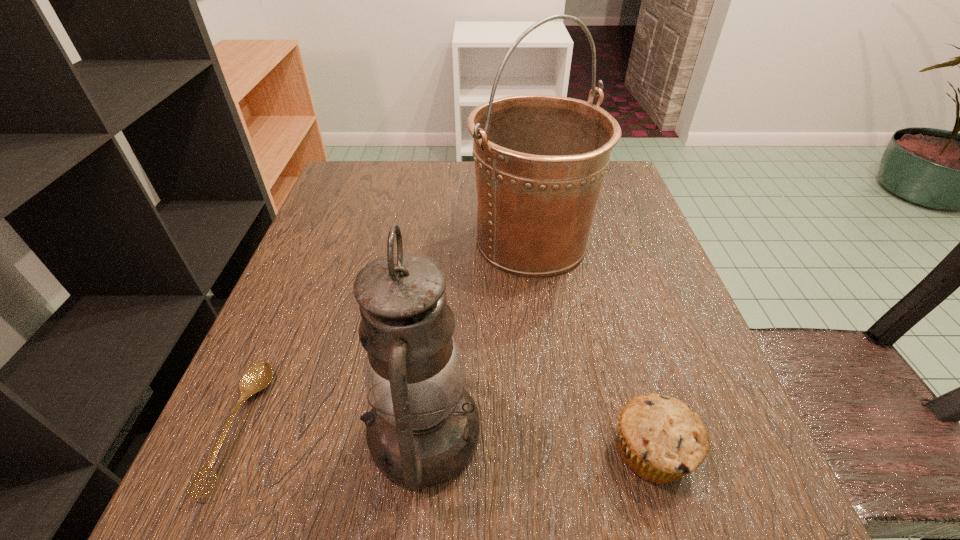
Where is `bucket`? This screenshot has width=960, height=540. bucket is located at coordinates (540, 160).

The height and width of the screenshot is (540, 960). Identify the location of the tallest object. (540, 160).

The image size is (960, 540). Identify the location of oil lamp. (423, 429).

The height and width of the screenshot is (540, 960). What are the coordinates of `the second shortest object` in the screenshot? It's located at (660, 438).

Image resolution: width=960 pixels, height=540 pixels. I want to click on the shortest object, so click(258, 377).

Identify the location of the leftmost object. The height and width of the screenshot is (540, 960). (258, 377).

I want to click on blank space located on the front of the bucket, so click(550, 373).

Find the location of a particular element. The width and height of the screenshot is (960, 540). free point located 0.260m on the back of the second tallest object is located at coordinates (441, 264).

Identify the location of free location located on the back of the muffin. click(592, 249).

What are the coordinates of `free region located on the back of the shortest object` in the screenshot? It's located at (282, 328).